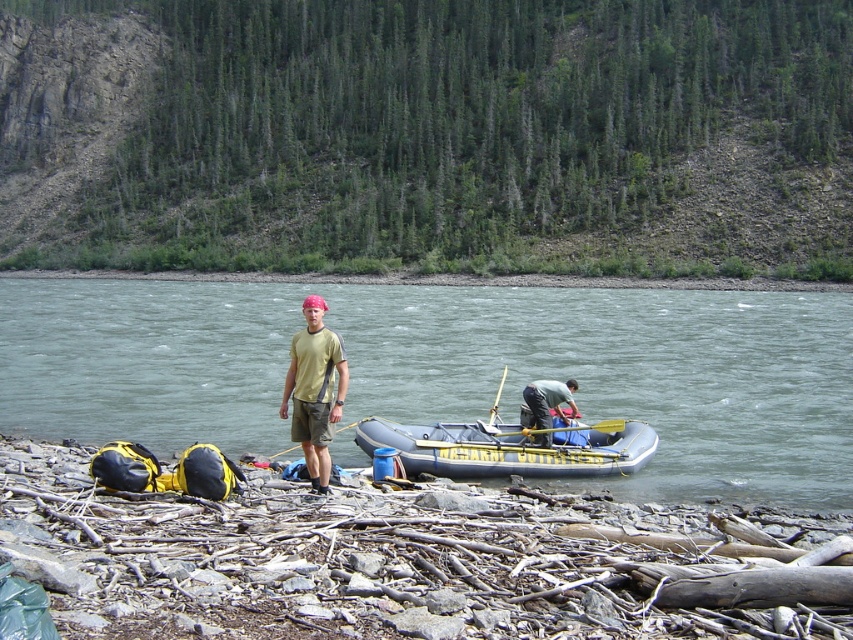
Who is higher up, matte yellow t-shirt at center or matte blue raft at center?

matte yellow t-shirt at center is higher up.

Who is shorter, matte yellow t-shirt at center or matte blue raft at center?

matte blue raft at center

Does point (335, 400) come closer to viewer compared to point (535, 390)?

Yes.

This screenshot has height=640, width=853. Identify the location of matte yellow t-shirt at center. (314, 390).

From the picture: Who is shorter, inflatable yellow at lower center or matte yellow t-shirt at center?

Standing shorter between the two is inflatable yellow at lower center.

Measure the distance from inflatable yellow at lower center to matte yellow t-shirt at center.

The distance of inflatable yellow at lower center from matte yellow t-shirt at center is 3.70 meters.

Does point (488, 456) come farther from viewer compared to point (340, 392)?

Yes.

Identify the location of inflatable yellow at lower center. (508, 449).

Is point (614, 460) farther from viewer compared to point (543, 445)?

No, (614, 460) is closer to viewer.

Does inflatable yellow at lower center have a larger size compared to matte blue raft at center?

Indeed, inflatable yellow at lower center has a larger size compared to matte blue raft at center.

Which is behind, point (505, 433) or point (540, 394)?

Point (540, 394)

In order to click on inflatable yellow at lower center in this screenshot , I will do `click(508, 449)`.